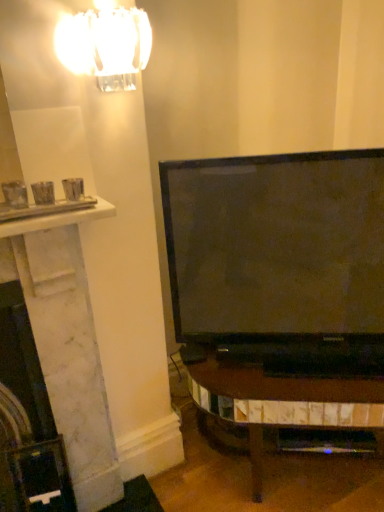
Question: Considering their positions, is clear glass chandelier at upper left located in front of or behind white marble fireplace at left?

Choices:
 (A) front
 (B) behind

Answer: (A)

Question: Considering the relative positions of clear glass chandelier at upper left and white marble fireplace at left in the image provided, is clear glass chandelier at upper left to the left or to the right of white marble fireplace at left?

Choices:
 (A) left
 (B) right

Answer: (B)

Question: In terms of height, does clear glass chandelier at upper left look taller or shorter compared to white marble fireplace at left?

Choices:
 (A) short
 (B) tall

Answer: (A)

Question: From the image's perspective, is white marble fireplace at left located above or below clear glass chandelier at upper left?

Choices:
 (A) below
 (B) above

Answer: (A)

Question: From a real-world perspective, relative to clear glass chandelier at upper left, is white marble fireplace at left vertically above or below?

Choices:
 (A) below
 (B) above

Answer: (A)

Question: Looking at their shapes, would you say white marble fireplace at left is wider or thinner than clear glass chandelier at upper left?

Choices:
 (A) wide
 (B) thin

Answer: (A)

Question: Considering their positions, is white marble fireplace at left located in front of or behind clear glass chandelier at upper left?

Choices:
 (A) behind
 (B) front

Answer: (A)